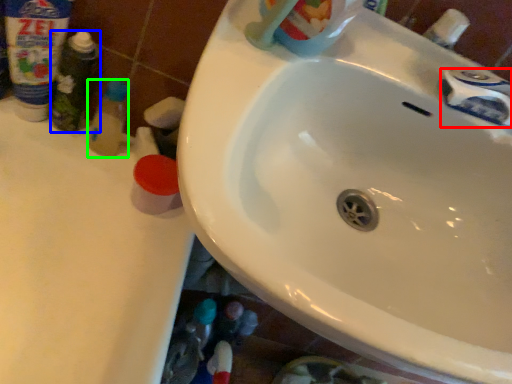
Question: Which object is positioned farthest from plumbing fixture (highlighted by a red box)? Select from toiletry (highlighted by a blue box) and toiletry (highlighted by a green box).

Choices:
 (A) toiletry
 (B) toiletry

Answer: (A)